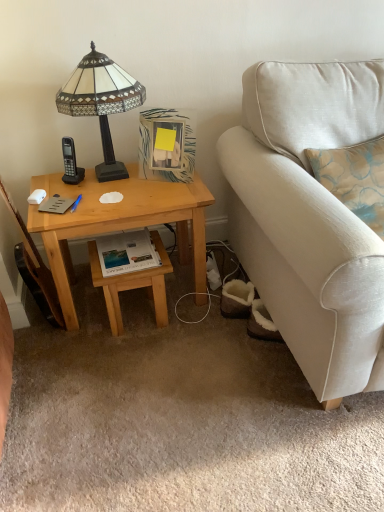
Identify the location of free space in front of light wood desk at left. This screenshot has width=384, height=512. (134, 377).